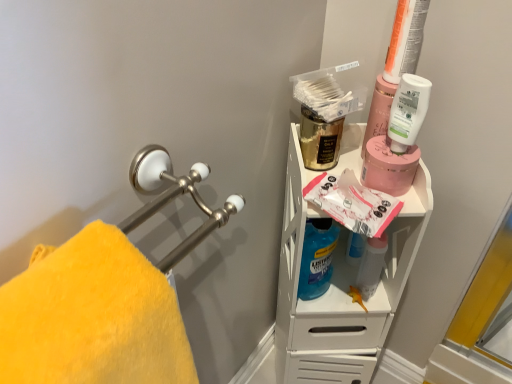
Question: Is white matte lotion at upper right, the third cleaning product positioned from the left, at the left side of yellow plush towel at left?

Choices:
 (A) no
 (B) yes

Answer: (A)

Question: Does white matte lotion at upper right, the third cleaning product positioned from the left, have a lesser height compared to yellow plush towel at left?

Choices:
 (A) yes
 (B) no

Answer: (B)

Question: From the image's perspective, is white matte lotion at upper right, the third cleaning product positioned from the left, located above yellow plush towel at left?

Choices:
 (A) no
 (B) yes

Answer: (B)

Question: Does white matte lotion at upper right, marked as the first cleaning product in a top-to-bottom arrangement, have a greater width compared to yellow plush towel at left?

Choices:
 (A) yes
 (B) no

Answer: (B)

Question: Is white matte lotion at upper right, which ranks as the first cleaning product in right-to-left order, oriented away from yellow plush towel at left?

Choices:
 (A) no
 (B) yes

Answer: (A)

Question: Does point (14, 352) appear closer or farther from the camera than point (421, 117)?

Choices:
 (A) farther
 (B) closer

Answer: (B)

Question: Based on their sizes in the image, would you say yellow plush towel at left is bigger or smaller than white matte lotion at upper right, the third cleaning product positioned from the left?

Choices:
 (A) small
 (B) big

Answer: (B)

Question: From the image's perspective, is yellow plush towel at left above or below white matte lotion at upper right, marked as the 3th cleaning product in a bottom-to-top arrangement?

Choices:
 (A) above
 (B) below

Answer: (B)

Question: Considering the positions of yellow plush towel at left and white matte lotion at upper right, which ranks as the first cleaning product in right-to-left order, in the image, is yellow plush towel at left taller or shorter than white matte lotion at upper right, which ranks as the first cleaning product in right-to-left order,?

Choices:
 (A) short
 (B) tall

Answer: (A)

Question: Is matte white shelf at upper right in front of or behind white matte lotion at upper right, marked as the first cleaning product in a top-to-bottom arrangement, in the image?

Choices:
 (A) behind
 (B) front

Answer: (A)

Question: Based on their sizes in the image, would you say matte white shelf at upper right is bigger or smaller than white matte lotion at upper right, marked as the 3th cleaning product in a bottom-to-top arrangement?

Choices:
 (A) small
 (B) big

Answer: (B)

Question: From the image's perspective, is matte white shelf at upper right located above or below white matte lotion at upper right, the third cleaning product positioned from the left?

Choices:
 (A) above
 (B) below

Answer: (B)

Question: Does point (356, 365) appear closer or farther from the camera than point (397, 117)?

Choices:
 (A) farther
 (B) closer

Answer: (A)

Question: Based on their positions, is pink matte jar at upper right located to the left or right of gold metallic mouthwash at upper center, placed as the 1th mouthwash when sorted from left to right?

Choices:
 (A) left
 (B) right

Answer: (B)

Question: From their relative heights in the image, would you say pink matte jar at upper right is taller or shorter than gold metallic mouthwash at upper center, placed as the 1th mouthwash when sorted from left to right?

Choices:
 (A) short
 (B) tall

Answer: (A)